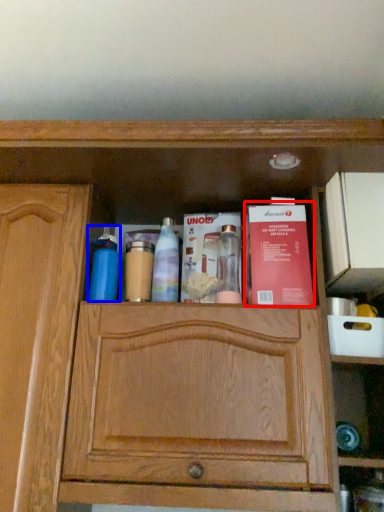
Question: Which object appears closest to the camera in this image, book (highlighted by a red box) or cleaning product (highlighted by a blue box)?

Choices:
 (A) book
 (B) cleaning product

Answer: (A)